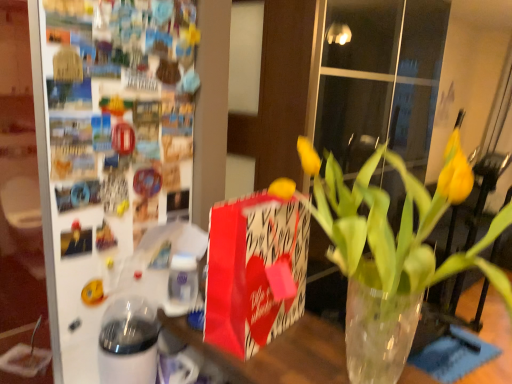
Where is `free point above translucent glass vase at center (from a real-world perspective)`? free point above translucent glass vase at center (from a real-world perspective) is located at coordinates (297, 347).